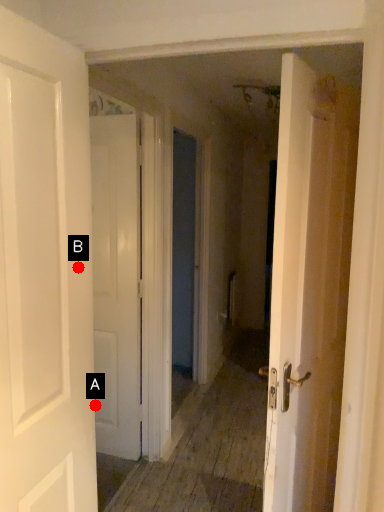
Question: Two points are circled on the image, labeled by A and B beside each circle. Which point appears farthest from the camera in this image?

Choices:
 (A) A is further
 (B) B is further

Answer: (A)